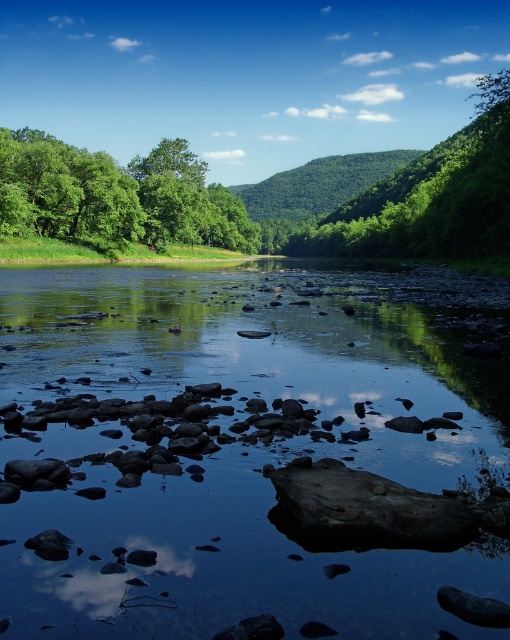
Question: Which point is farther to the camera?

Choices:
 (A) (78, 547)
 (B) (228, 230)
 (C) (400, 243)

Answer: (B)

Question: Can you confirm if smooth rock stream at center is positioned to the right of green leafy tree at upper center?

Choices:
 (A) no
 (B) yes

Answer: (A)

Question: Is green leafy tree at upper left positioned in front of green leafy tree at upper center?

Choices:
 (A) no
 (B) yes

Answer: (A)

Question: Which point is closer to the camera?

Choices:
 (A) (89, 198)
 (B) (338, 308)

Answer: (B)

Question: Among these points, which one is farthest from the camera?

Choices:
 (A) (335, 499)
 (B) (493, 234)
 (C) (11, 216)

Answer: (C)

Question: Does green leafy tree at upper left have a larger size compared to green leafy tree at upper center?

Choices:
 (A) no
 (B) yes

Answer: (A)